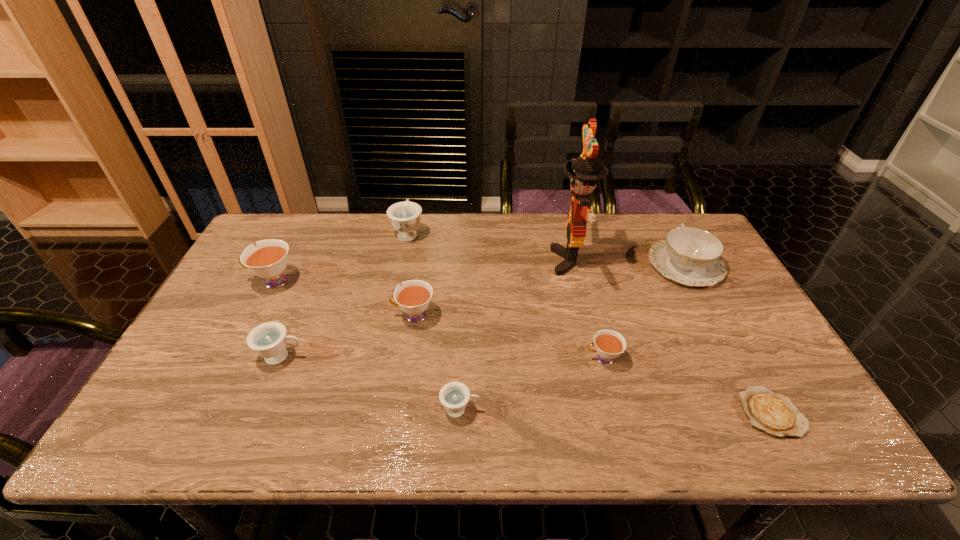
Locate an element on the screen. The width and height of the screenshot is (960, 540). object that is at the far right corner is located at coordinates (690, 256).

Where is `object present at the near right corner`? object present at the near right corner is located at coordinates (773, 413).

Locate an element on the screen. free location at the far edge is located at coordinates (456, 213).

The height and width of the screenshot is (540, 960). In the image, there is a desktop. In order to click on vacant space at the near edge in this screenshot , I will do `click(610, 441)`.

In the image, there is a desktop. At what (x,y) coordinates should I click in order to perform the action: click on vacant space at the right edge. Please return your answer as a coordinate pair (x, y). Image resolution: width=960 pixels, height=540 pixels. Looking at the image, I should click on (776, 364).

Locate an element on the screen. The image size is (960, 540). vacant space at the far left corner of the desktop is located at coordinates (264, 222).

The width and height of the screenshot is (960, 540). I want to click on empty space between the smallest blue teacup and the nutcracker, so click(516, 335).

You are a GUI agent. You are given a task and a screenshot of the screen. Output one action in this format:
    pyautogui.click(x=<x>, y=<y>)
    Task: Click on the free spot between the fifth nearest object and the quiche
    
    Given the screenshot: What is the action you would take?
    pyautogui.click(x=592, y=364)

Where is `free space between the smallest blue teacup and the fifth nearest object`? free space between the smallest blue teacup and the fifth nearest object is located at coordinates (437, 363).

The width and height of the screenshot is (960, 540). I want to click on free space between the second farthest teacup and the chinaware, so click(479, 273).